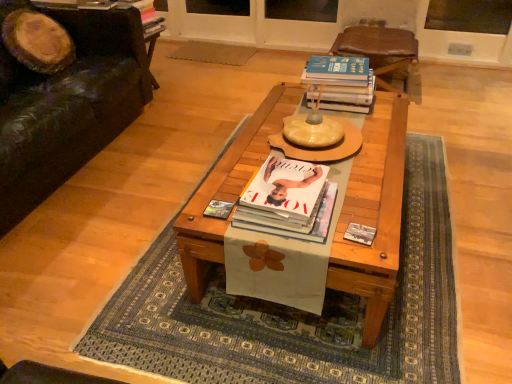
Question: From a real-world perspective, is matte yellow round table at center beneath black leather couch at left?

Choices:
 (A) no
 (B) yes

Answer: (A)

Question: Is matte yellow round table at center at the right side of black leather couch at left?

Choices:
 (A) no
 (B) yes

Answer: (B)

Question: From the image's perspective, does matte yellow round table at center appear lower than black leather couch at left?

Choices:
 (A) no
 (B) yes

Answer: (B)

Question: Is matte yellow round table at center further to camera compared to black leather couch at left?

Choices:
 (A) no
 (B) yes

Answer: (B)

Question: Is matte yellow round table at center shorter than black leather couch at left?

Choices:
 (A) yes
 (B) no

Answer: (A)

Question: Is point (86, 28) positioned closer to the camera than point (223, 203)?

Choices:
 (A) farther
 (B) closer

Answer: (A)

Question: Which is correct: black leather couch at left is inside matte paper magazine at center, or outside of it?

Choices:
 (A) inside
 (B) outside

Answer: (B)

Question: Considering the positions of black leather couch at left and matte paper magazine at center in the image, is black leather couch at left taller or shorter than matte paper magazine at center?

Choices:
 (A) short
 (B) tall

Answer: (B)

Question: From the image's perspective, is black leather couch at left above or below matte paper magazine at center?

Choices:
 (A) below
 (B) above

Answer: (B)

Question: Considering the positions of hardcover book at upper right, which appears as the first book when viewed from the back, and matte yellow round table at center in the image, is hardcover book at upper right, which appears as the first book when viewed from the back, bigger or smaller than matte yellow round table at center?

Choices:
 (A) big
 (B) small

Answer: (B)

Question: Considering the relative positions of hardcover book at upper right, which appears as the first book when viewed from the back, and matte yellow round table at center in the image provided, is hardcover book at upper right, which appears as the first book when viewed from the back, to the left or to the right of matte yellow round table at center?

Choices:
 (A) right
 (B) left

Answer: (A)

Question: From their relative heights in the image, would you say hardcover book at upper right, marked as the 1th book in a right-to-left arrangement, is taller or shorter than matte yellow round table at center?

Choices:
 (A) tall
 (B) short

Answer: (B)

Question: Which is correct: hardcover book at upper right, which appears as the first book when viewed from the back, is inside matte yellow round table at center, or outside of it?

Choices:
 (A) inside
 (B) outside

Answer: (B)

Question: From the image's perspective, relative to white paper with flower design at center, is matte paper magazine at center above or below?

Choices:
 (A) above
 (B) below

Answer: (A)

Question: Is matte paper magazine at center in front of or behind white paper with flower design at center in the image?

Choices:
 (A) behind
 (B) front

Answer: (A)